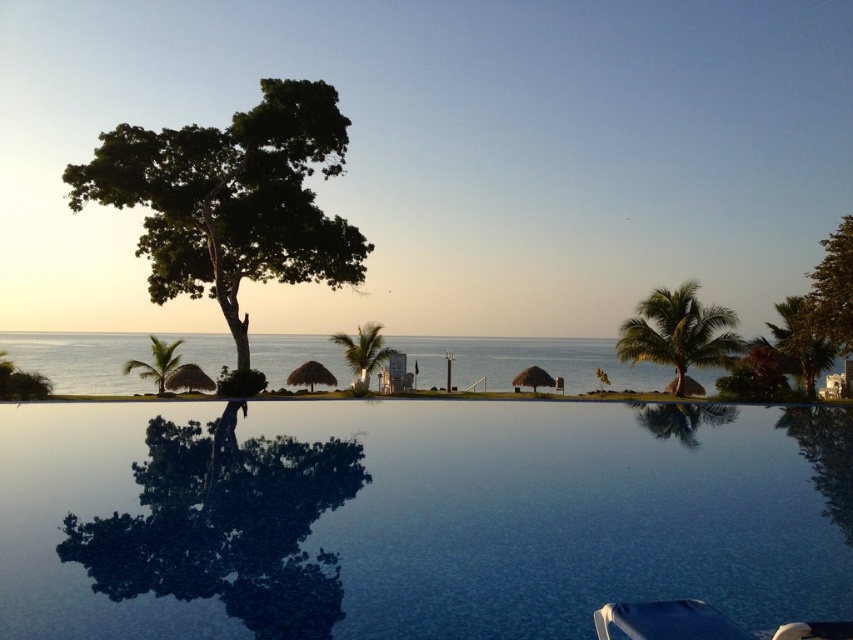
Question: Estimate the real-world distances between objects in this image. Which object is closer to the green leafy palm tree at center?

Choices:
 (A) transparent glass pool at center
 (B) green leafy tree at left
 (C) white plastic beach chair at lower right
 (D) green leafy palm tree at left

Answer: (B)

Question: Where is green leafy palm tree at center located in relation to green leafy palm tree at left in the image?

Choices:
 (A) above
 (B) below

Answer: (A)

Question: Which object is positioned farthest from the transparent glass pool at center?

Choices:
 (A) green leafy palm tree at left
 (B) green leafy palm tree at right
 (C) white plastic beach chair at lower right

Answer: (A)

Question: Is white plastic beach chair at lower right wider than green leafy palm tree at right?

Choices:
 (A) yes
 (B) no

Answer: (B)

Question: Can you confirm if green leafy tree at left is smaller than green leafy palm tree at right?

Choices:
 (A) no
 (B) yes

Answer: (A)

Question: Among these points, which one is farthest from the camera?

Choices:
 (A) (x=271, y=540)
 (B) (x=640, y=612)
 (C) (x=364, y=268)
 (D) (x=805, y=381)

Answer: (C)